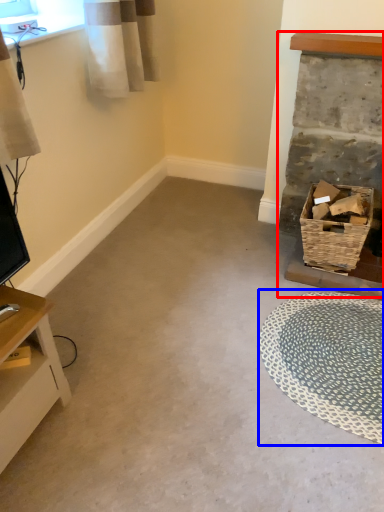
Question: Which object is further to the camera taking this photo, fireplace (highlighted by a red box) or mat (highlighted by a blue box)?

Choices:
 (A) fireplace
 (B) mat

Answer: (A)